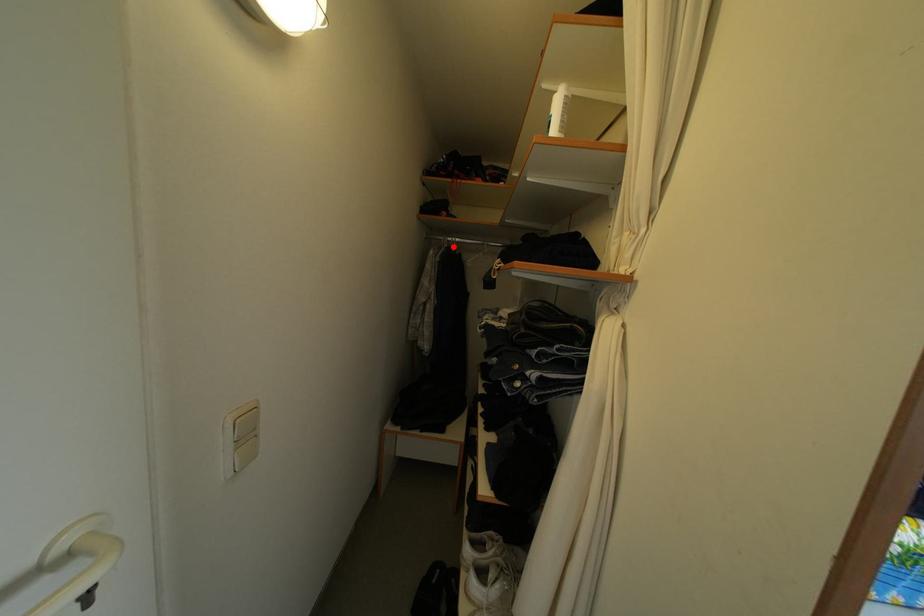
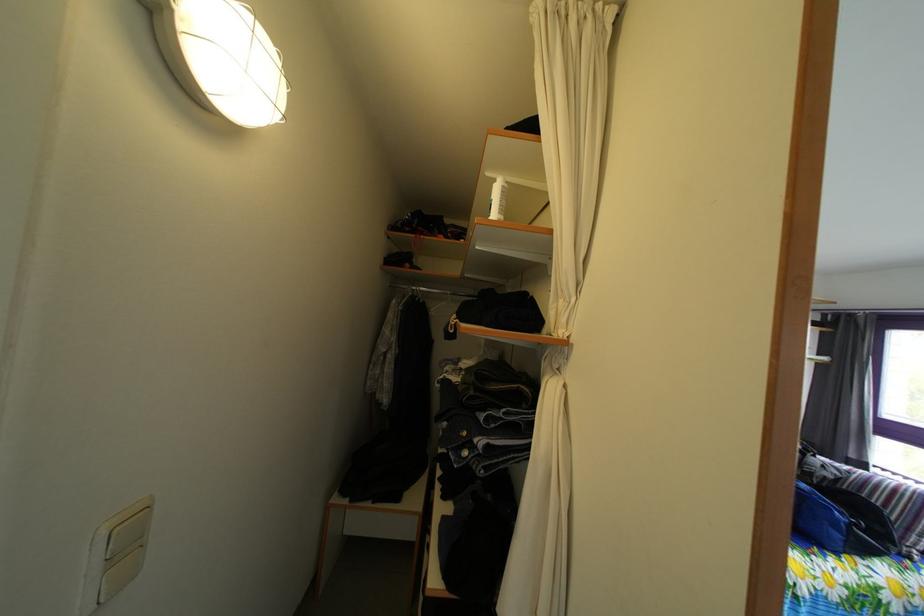
Question: I am providing you with two images of the same scene from different viewpoints. A red point is marked on the first image. Can you still see the location of the red point in image 2?

Choices:
 (A) Yes
 (B) No

Answer: (A)